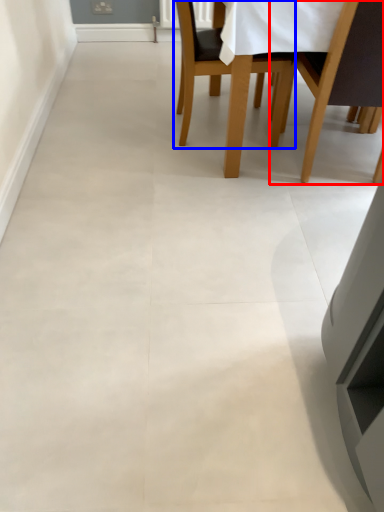
Question: Which of the following is the closest to the observer, chair (highlighted by a red box) or chair (highlighted by a blue box)?

Choices:
 (A) chair
 (B) chair

Answer: (A)